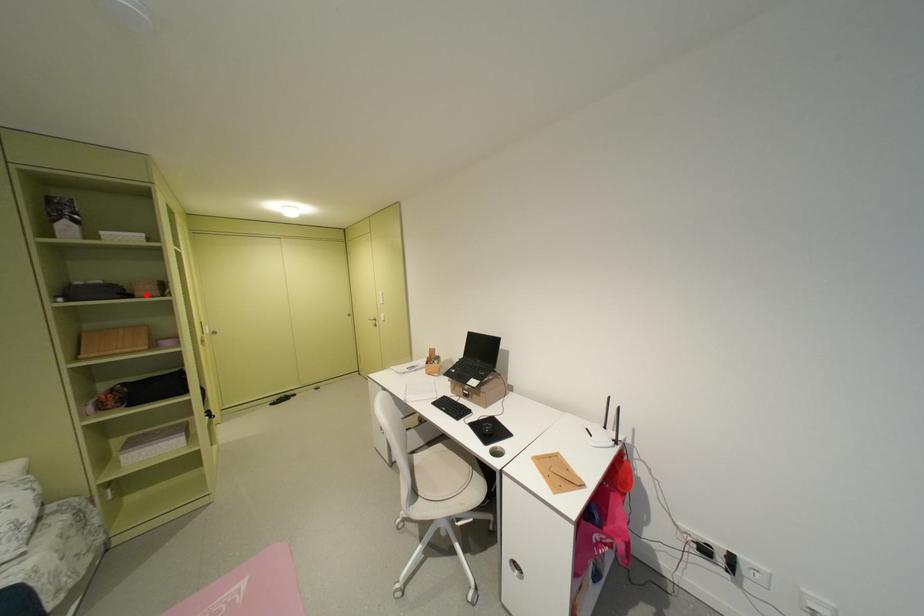
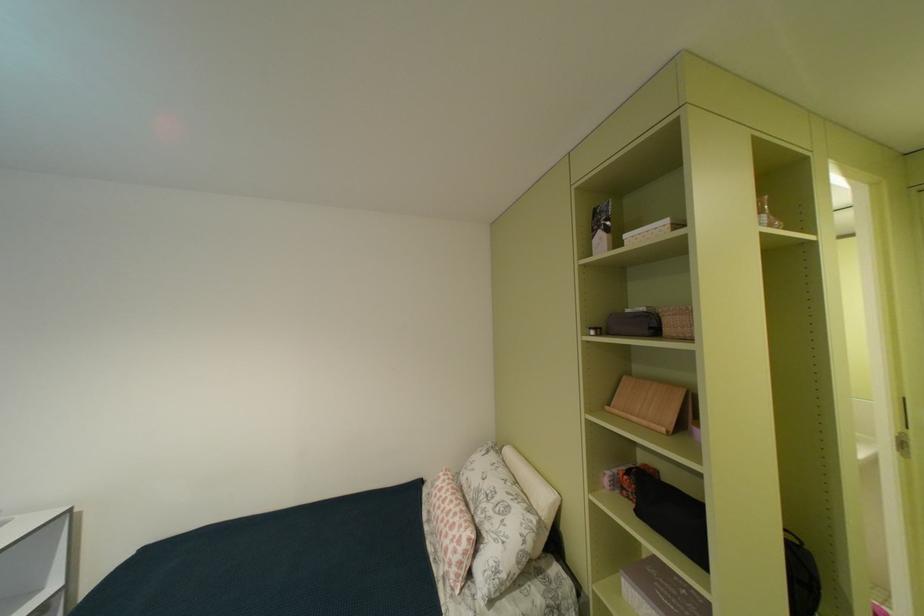
Find the pixel in the second image that matches the highlighted location in the first image.

(675, 331)